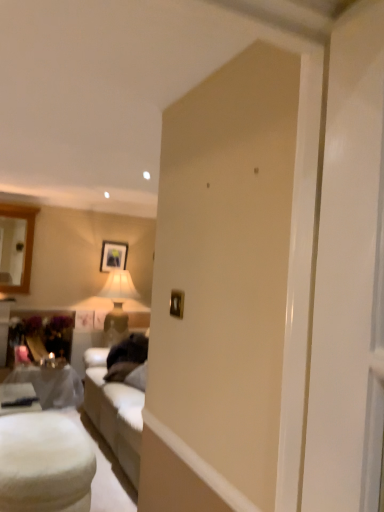
Question: Can we say matte gray table at lower left, acting as the second table starting from the front, lies outside metallic gold picture frame at center, placed as the 2th picture frame when sorted from left to right?

Choices:
 (A) no
 (B) yes

Answer: (B)

Question: From a real-world perspective, does matte gray table at lower left, the first table viewed from the back, stand above metallic gold picture frame at center, which is the first picture frame in right-to-left order?

Choices:
 (A) yes
 (B) no

Answer: (B)

Question: From a real-world perspective, is matte gray table at lower left, acting as the second table starting from the front, positioned under metallic gold picture frame at center, placed as the 2th picture frame when sorted from back to front, based on gravity?

Choices:
 (A) no
 (B) yes

Answer: (B)

Question: Does matte gray table at lower left, acting as the second table starting from the front, appear on the left side of metallic gold picture frame at center, placed as the 2th picture frame when sorted from back to front?

Choices:
 (A) no
 (B) yes

Answer: (B)

Question: From the image's perspective, is matte gray table at lower left, acting as the second table starting from the front, above metallic gold picture frame at center, placed as the 2th picture frame when sorted from left to right?

Choices:
 (A) no
 (B) yes

Answer: (A)

Question: Does matte gray table at lower left, the first table viewed from the back, have a lesser height compared to metallic gold picture frame at center, arranged as the 1th picture frame when viewed from the front?

Choices:
 (A) no
 (B) yes

Answer: (A)

Question: Considering the relative sizes of white fluffy ottoman at lower left, which is counted as the 2th table, starting from the back, and matte black picture frame at upper center, which is the 1th picture frame in left-to-right order, in the image provided, is white fluffy ottoman at lower left, which is counted as the 2th table, starting from the back, bigger than matte black picture frame at upper center, which is the 1th picture frame in left-to-right order,?

Choices:
 (A) yes
 (B) no

Answer: (A)

Question: From a real-world perspective, is white fluffy ottoman at lower left, which is the first table from front to back, physically below matte black picture frame at upper center, positioned as the 2th picture frame in front-to-back order?

Choices:
 (A) yes
 (B) no

Answer: (A)

Question: Is white fluffy ottoman at lower left, which is counted as the 2th table, starting from the back, behind matte black picture frame at upper center, positioned as the 2th picture frame in front-to-back order?

Choices:
 (A) yes
 (B) no

Answer: (B)

Question: Are white fluffy ottoman at lower left, which is counted as the 2th table, starting from the back, and matte black picture frame at upper center, which ranks as the 2th picture frame in right-to-left order, located far from each other?

Choices:
 (A) yes
 (B) no

Answer: (A)

Question: From a real-world perspective, does white fluffy ottoman at lower left, which is the first table from front to back, stand above matte black picture frame at upper center, which is the 1th picture frame in left-to-right order?

Choices:
 (A) yes
 (B) no

Answer: (B)

Question: Can we say white fluffy ottoman at lower left, which is the first table from front to back, lies outside matte black picture frame at upper center, the 1th picture frame from the back?

Choices:
 (A) no
 (B) yes

Answer: (B)

Question: Considering the relative positions of metallic gold picture frame at center, placed as the 2th picture frame when sorted from left to right, and matte black picture frame at upper center, positioned as the 2th picture frame in front-to-back order, in the image provided, is metallic gold picture frame at center, placed as the 2th picture frame when sorted from left to right, to the left of matte black picture frame at upper center, positioned as the 2th picture frame in front-to-back order, from the viewer's perspective?

Choices:
 (A) no
 (B) yes

Answer: (A)